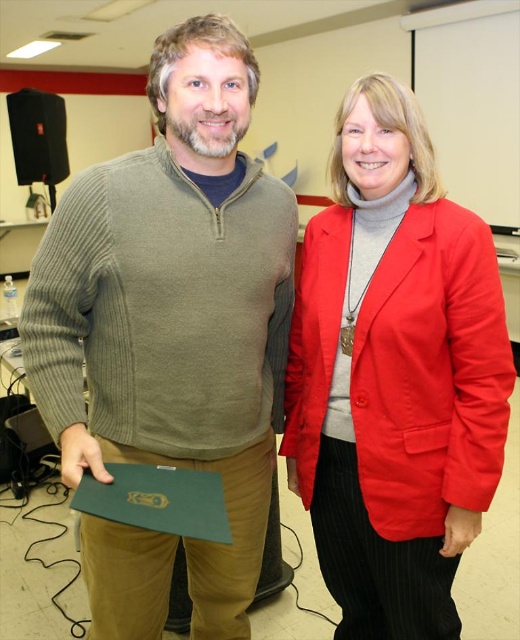
Does green ribbed sweater at left appear on the right side of red cotton blazer at center?

Incorrect, green ribbed sweater at left is not on the right side of red cotton blazer at center.

Can you confirm if green ribbed sweater at left is taller than red cotton blazer at center?

Indeed, green ribbed sweater at left has a greater height compared to red cotton blazer at center.

What do you see at coordinates (175, 307) in the screenshot? This screenshot has height=640, width=520. I see `green ribbed sweater at left` at bounding box center [175, 307].

I want to click on green ribbed sweater at left, so click(x=175, y=307).

Does point (235, 342) come farther from viewer compared to point (153, 483)?

That is True.

Describe the element at coordinates (175, 307) in the screenshot. Image resolution: width=520 pixels, height=640 pixels. I see `green ribbed sweater at left` at that location.

Describe the element at coordinates (175, 307) in the screenshot. I see `green ribbed sweater at left` at that location.

The width and height of the screenshot is (520, 640). In order to click on green ribbed sweater at left in this screenshot , I will do `click(175, 307)`.

Does red cotton blazer at center have a lesser height compared to green matte folder at lower left?

No, red cotton blazer at center is not shorter than green matte folder at lower left.

Is red cotton blazer at center in front of green matte folder at lower left?

No, red cotton blazer at center is further to the viewer.

Is point (471, 403) positioned behind point (177, 486)?

Yes, it is behind point (177, 486).

Identify the location of red cotton blazer at center. (395, 376).